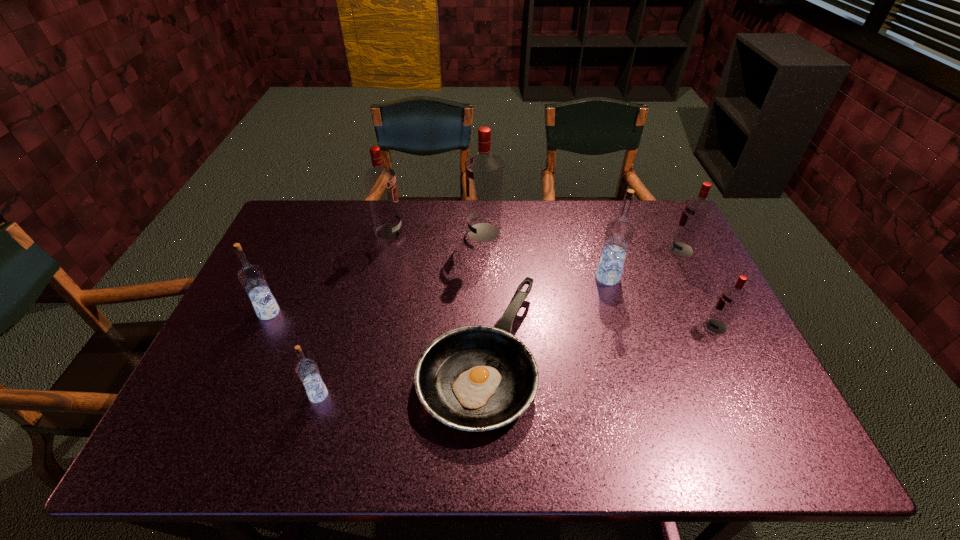
Find the location of a particular element. The height and width of the screenshot is (540, 960). the smallest blue vodka is located at coordinates (307, 370).

At what (x,y) coordinates should I click in order to perform the action: click on the sixth vodka from right to left. Please return your answer as a coordinate pair (x, y). The image size is (960, 540). Looking at the image, I should click on (307, 370).

Where is `frying pan`? The width and height of the screenshot is (960, 540). frying pan is located at coordinates (475, 378).

Locate an element on the screen. The width and height of the screenshot is (960, 540). the shortest object is located at coordinates (475, 378).

Find the location of `free space located 0.400m on the front label of the fourth vodka from right to left`. free space located 0.400m on the front label of the fourth vodka from right to left is located at coordinates (345, 233).

Where is `vacant space located 0.120m on the front label of the fourth vodka from right to left`? This screenshot has width=960, height=540. vacant space located 0.120m on the front label of the fourth vodka from right to left is located at coordinates pos(430,233).

At what (x,y) coordinates should I click in order to perform the action: click on free space located on the front label of the fourth vodka from right to left. Please return your answer as a coordinate pair (x, y). Looking at the image, I should click on (448, 233).

Find the location of a particular element. This screenshot has height=540, width=960. vacant point located 0.280m on the front label of the third smallest red vodka is located at coordinates (489, 232).

The image size is (960, 540). I want to click on free spot located 0.310m on the back of the fourth nearest vodka, so click(x=587, y=209).

Locate an element on the screen. Image resolution: width=960 pixels, height=540 pixels. vacant space located on the left of the leftmost object is located at coordinates (239, 313).